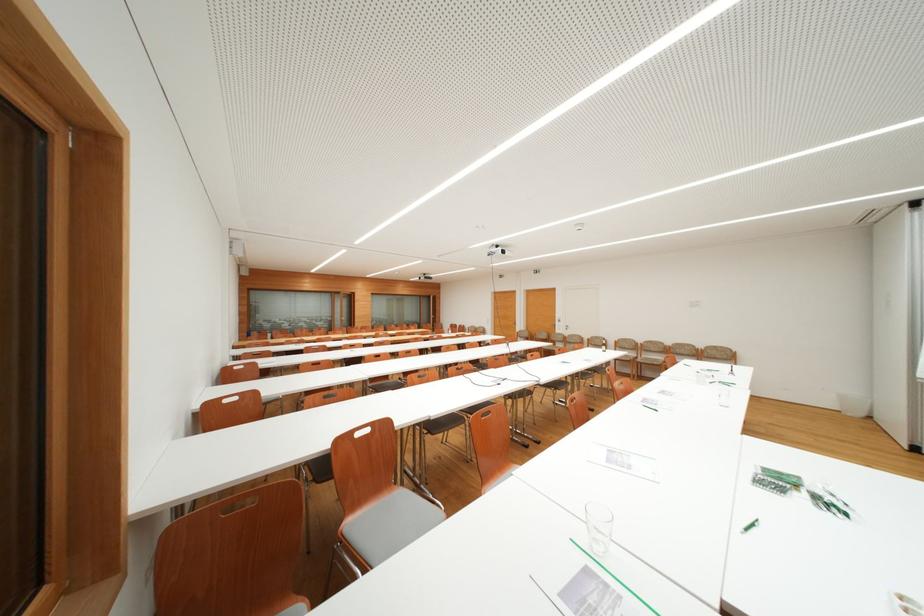
Describe the element at coordinates (853, 403) in the screenshot. I see `a white trash can` at that location.